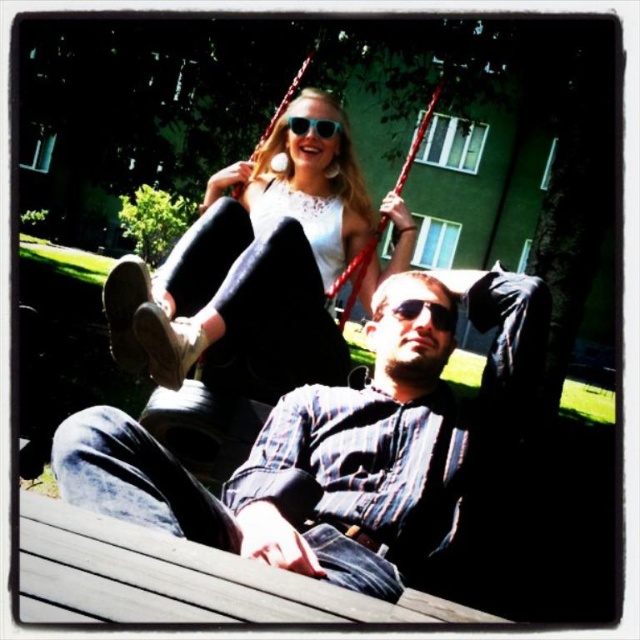
You are an observer standing in front of the scene. You notice the matte white blouse at upper center and the sunglasses at upper center. Which object is wider?

The matte white blouse at upper center is wider than the sunglasses at upper center.

You are standing at the point labeled as point (349, 449) in the image. Looking around, you see denim jeans at center. Which direction should you move to reach the denim jeans at center?

The point (349, 449) is already on the denim jeans at center, so you are already at the denim jeans at center.

You are a photographer trying to capture both the denim jeans at center and the matte white blouse at upper center in a single frame. Based on their positions, which object should you focus on first to ensure both are in focus?

The denim jeans at center is shorter than the matte white blouse at upper center, so you should focus on the denim jeans at center first to ensure both are in focus.